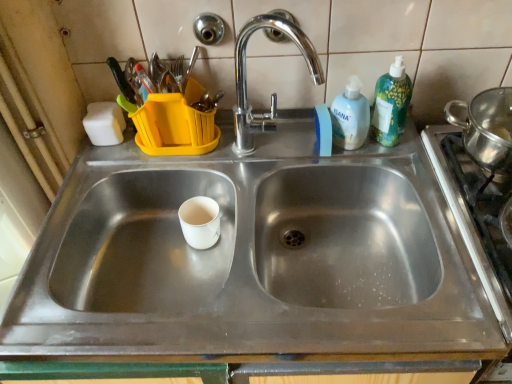
Question: Considering the relative positions of white matte paper cup at center and white plastic bottle at upper right, the 1th cleaning product when ordered from left to right, in the image provided, is white matte paper cup at center to the right of white plastic bottle at upper right, the 1th cleaning product when ordered from left to right, from the viewer's perspective?

Choices:
 (A) no
 (B) yes

Answer: (A)

Question: Is the position of white matte paper cup at center less distant than that of white plastic bottle at upper right, the 1th cleaning product when ordered from left to right?

Choices:
 (A) no
 (B) yes

Answer: (A)

Question: Can you confirm if white matte paper cup at center is bigger than white plastic bottle at upper right, the 1th cleaning product when ordered from left to right?

Choices:
 (A) no
 (B) yes

Answer: (A)

Question: Is white plastic bottle at upper right, marked as the 2th cleaning product in a right-to-left arrangement, at the back of white matte paper cup at center?

Choices:
 (A) yes
 (B) no

Answer: (B)

Question: From the image's perspective, is white matte paper cup at center on white plastic bottle at upper right, the 1th cleaning product when ordered from left to right?

Choices:
 (A) no
 (B) yes

Answer: (A)

Question: Which is correct: stainless steel gas stove at right is inside green plastic bottle at upper right, arranged as the 1th cleaning product when viewed from the right, or outside of it?

Choices:
 (A) outside
 (B) inside

Answer: (A)

Question: Looking at their shapes, would you say stainless steel gas stove at right is wider or thinner than green plastic bottle at upper right, arranged as the 1th cleaning product when viewed from the right?

Choices:
 (A) wide
 (B) thin

Answer: (A)

Question: Is point pyautogui.click(x=440, y=155) positioned closer to the camera than point pyautogui.click(x=396, y=119)?

Choices:
 (A) closer
 (B) farther

Answer: (B)

Question: In terms of height, does stainless steel gas stove at right look taller or shorter compared to green plastic bottle at upper right, arranged as the 1th cleaning product when viewed from the right?

Choices:
 (A) tall
 (B) short

Answer: (B)

Question: Looking at the image, does white matte sponge at upper left seem bigger or smaller compared to polished chrome faucet at upper center?

Choices:
 (A) small
 (B) big

Answer: (A)

Question: From a real-world perspective, relative to polished chrome faucet at upper center, is white matte sponge at upper left vertically above or below?

Choices:
 (A) below
 (B) above

Answer: (A)

Question: Considering the positions of white matte sponge at upper left and polished chrome faucet at upper center in the image, is white matte sponge at upper left taller or shorter than polished chrome faucet at upper center?

Choices:
 (A) tall
 (B) short

Answer: (B)

Question: Considering their positions, is white matte sponge at upper left located in front of or behind polished chrome faucet at upper center?

Choices:
 (A) behind
 (B) front

Answer: (A)

Question: From the image's perspective, is white matte paper cup at center located above or below white matte sponge at upper left?

Choices:
 (A) below
 (B) above

Answer: (A)

Question: Would you say white matte paper cup at center is inside or outside white matte sponge at upper left?

Choices:
 (A) outside
 (B) inside

Answer: (A)